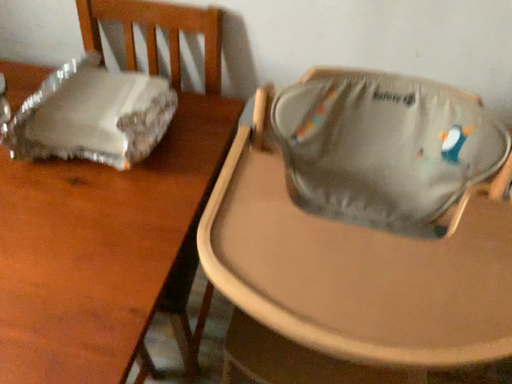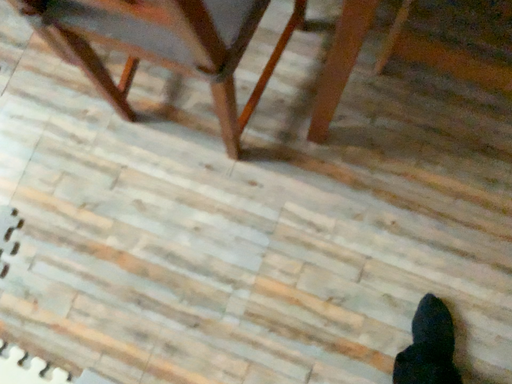
Question: How did the camera likely rotate when shooting the video?

Choices:
 (A) rotated downward
 (B) rotated upward

Answer: (A)